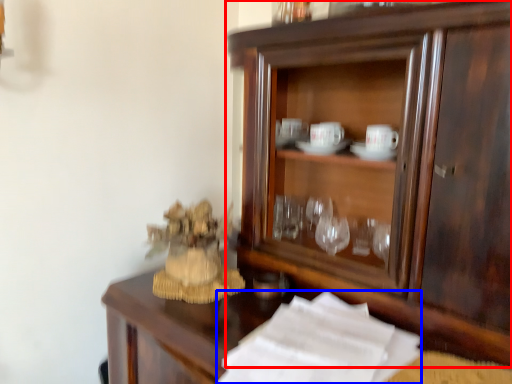
Question: Which of the following is the farthest to the observer, cupboard (highlighted by a red box) or paper (highlighted by a blue box)?

Choices:
 (A) cupboard
 (B) paper

Answer: (A)